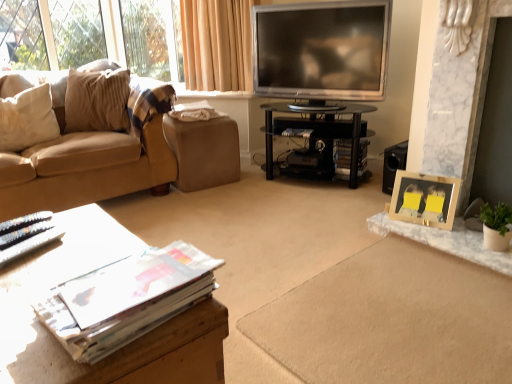
Question: From a real-world perspective, is wooden table at lower left, the 1th table from the left, below matte paper magazine at center, which is the second magazine in bottom-to-top order?

Choices:
 (A) yes
 (B) no

Answer: (B)

Question: Can you confirm if wooden table at lower left, which is the 2th table from top to bottom, is smaller than matte paper magazine at center, which appears as the third magazine when viewed from the front?

Choices:
 (A) no
 (B) yes

Answer: (A)

Question: Is wooden table at lower left, the 1th table from the left, facing away from matte paper magazine at center, which appears as the 1th magazine when viewed from the back?

Choices:
 (A) no
 (B) yes

Answer: (A)

Question: Is wooden table at lower left, the 1th table from the left, closer to the viewer compared to matte paper magazine at center, which is the first magazine from right to left?

Choices:
 (A) yes
 (B) no

Answer: (A)

Question: Is wooden table at lower left, which is counted as the second table, starting from the right, touching matte paper magazine at center, which is the first magazine from right to left?

Choices:
 (A) yes
 (B) no

Answer: (B)

Question: Is silver metallic television at upper center bigger or smaller than brown leather footrest at center?

Choices:
 (A) small
 (B) big

Answer: (B)

Question: Relative to brown leather footrest at center, is silver metallic television at upper center in front or behind?

Choices:
 (A) behind
 (B) front

Answer: (B)

Question: Looking at their shapes, would you say silver metallic television at upper center is wider or thinner than brown leather footrest at center?

Choices:
 (A) thin
 (B) wide

Answer: (A)

Question: Is silver metallic television at upper center to the left or to the right of brown leather footrest at center in the image?

Choices:
 (A) right
 (B) left

Answer: (A)

Question: Is brown leather footrest at center taller or shorter than matte paper magazine at center, which ranks as the second magazine in back-to-front order?

Choices:
 (A) tall
 (B) short

Answer: (A)

Question: Is brown leather footrest at center bigger or smaller than matte paper magazine at center, acting as the third magazine starting from the bottom?

Choices:
 (A) big
 (B) small

Answer: (A)

Question: Relative to matte paper magazine at center, arranged as the 2th magazine when viewed from the front, is brown leather footrest at center in front or behind?

Choices:
 (A) behind
 (B) front

Answer: (B)

Question: From the image's perspective, is brown leather footrest at center located above or below matte paper magazine at center, arranged as the 2th magazine when viewed from the front?

Choices:
 (A) below
 (B) above

Answer: (A)

Question: From a real-world perspective, relative to wooden table at lower left, which is counted as the second table, starting from the right, is beige corduroy couch at left vertically above or below?

Choices:
 (A) below
 (B) above

Answer: (B)

Question: In terms of width, does beige corduroy couch at left look wider or thinner when compared to wooden table at lower left, which is the 2th table from top to bottom?

Choices:
 (A) thin
 (B) wide

Answer: (B)